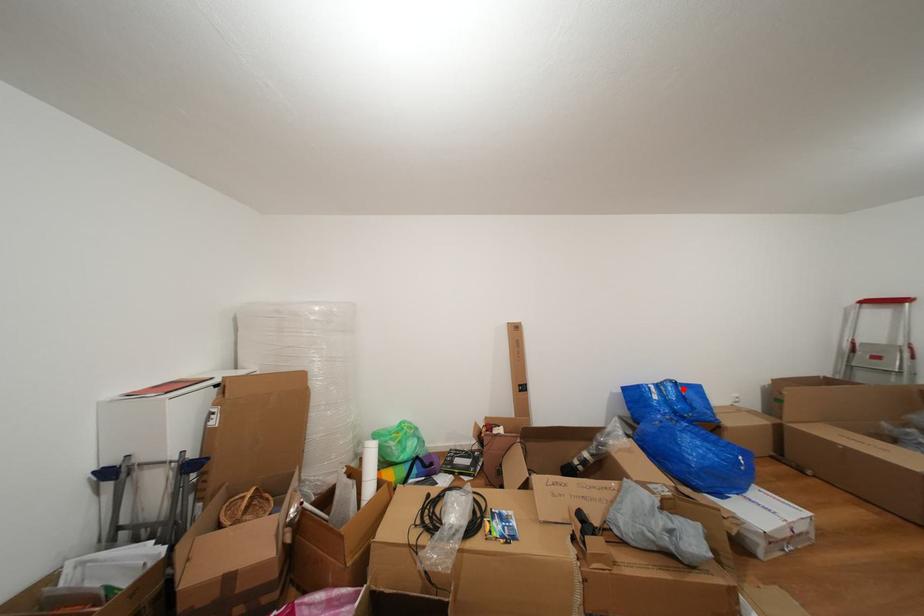
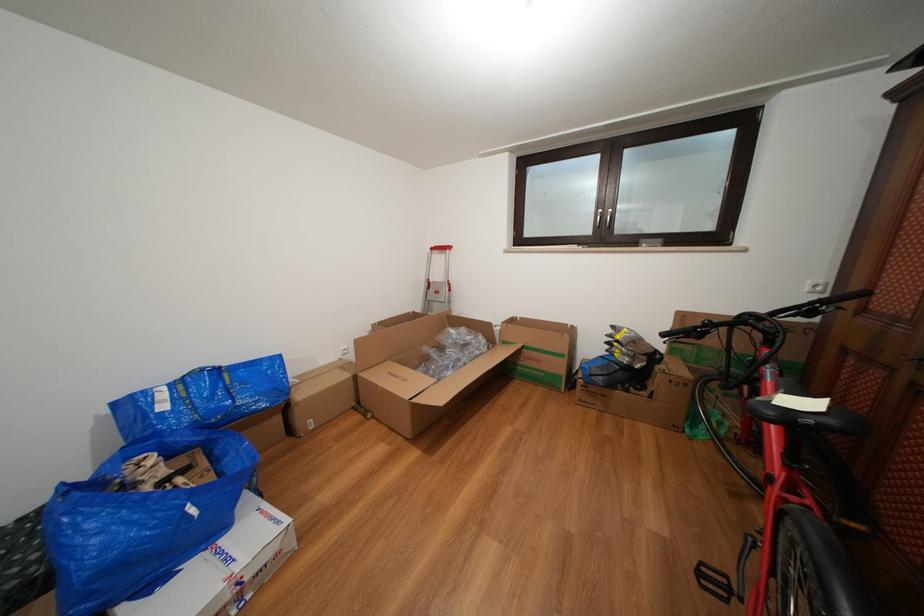
Where in the second image is the point corresponding to the highlighted location from the first image?

(225, 376)